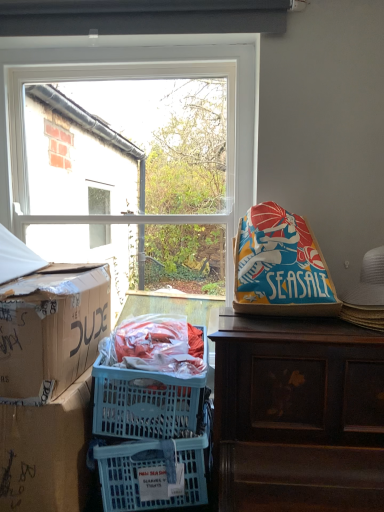
Question: Is brown wooden desk at upper right bigger than clear glass window at upper center?

Choices:
 (A) yes
 (B) no

Answer: (A)

Question: Can we say brown wooden desk at upper right lies outside clear glass window at upper center?

Choices:
 (A) no
 (B) yes

Answer: (B)

Question: Is clear glass window at upper center completely or partially inside brown wooden desk at upper right?

Choices:
 (A) yes
 (B) no

Answer: (B)

Question: Is brown wooden desk at upper right closer to camera compared to clear glass window at upper center?

Choices:
 (A) no
 (B) yes

Answer: (B)

Question: Considering the relative positions of brown wooden desk at upper right and clear glass window at upper center in the image provided, is brown wooden desk at upper right to the left of clear glass window at upper center from the viewer's perspective?

Choices:
 (A) yes
 (B) no

Answer: (B)

Question: In terms of size, does brown wooden desk at upper right appear bigger or smaller than clear glass window at upper center?

Choices:
 (A) big
 (B) small

Answer: (A)

Question: Is brown wooden desk at upper right spatially inside clear glass window at upper center, or outside of it?

Choices:
 (A) outside
 (B) inside

Answer: (A)

Question: Considering the positions of brown wooden desk at upper right and clear glass window at upper center in the image, is brown wooden desk at upper right wider or thinner than clear glass window at upper center?

Choices:
 (A) thin
 (B) wide

Answer: (B)

Question: Relative to clear glass window at upper center, is brown wooden desk at upper right in front or behind?

Choices:
 (A) behind
 (B) front

Answer: (B)

Question: Looking at their shapes, would you say cardboard box at left, arranged as the 1th box when ordered from the bottom, is wider or thinner than blue fabric bean bag at right?

Choices:
 (A) thin
 (B) wide

Answer: (B)

Question: Is cardboard box at left, arranged as the 1th box when ordered from the bottom, bigger or smaller than blue fabric bean bag at right?

Choices:
 (A) big
 (B) small

Answer: (A)

Question: Is cardboard box at left, acting as the 2th box starting from the top, taller or shorter than blue fabric bean bag at right?

Choices:
 (A) tall
 (B) short

Answer: (A)

Question: Considering the positions of point (39, 482) and point (259, 273), is point (39, 482) closer or farther from the camera than point (259, 273)?

Choices:
 (A) closer
 (B) farther

Answer: (A)

Question: Looking at the image, does brown wooden desk at upper right seem bigger or smaller compared to cardboard box at left, positioned as the 1th box in top-to-bottom order?

Choices:
 (A) small
 (B) big

Answer: (B)

Question: Would you say brown wooden desk at upper right is inside or outside cardboard box at left, positioned as the 1th box in top-to-bottom order?

Choices:
 (A) outside
 (B) inside

Answer: (A)